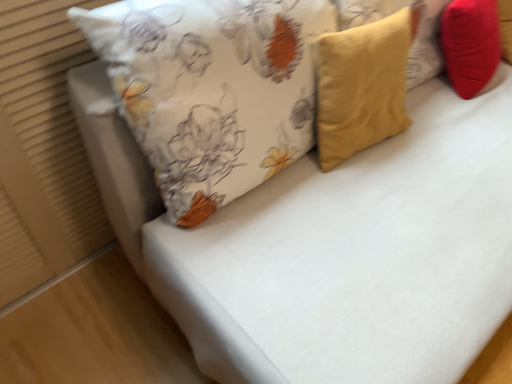
In order to face matte yellow pillow at center, should I rotate leftwards or rightwards?

To face it directly, rotate left by 2.412 degrees.

What do you see at coordinates (211, 89) in the screenshot?
I see `matte yellow pillow at center` at bounding box center [211, 89].

Find the location of a particular element. matte yellow pillow at center is located at coordinates (211, 89).

Where is `matte yellow pillow at center`? matte yellow pillow at center is located at coordinates (211, 89).